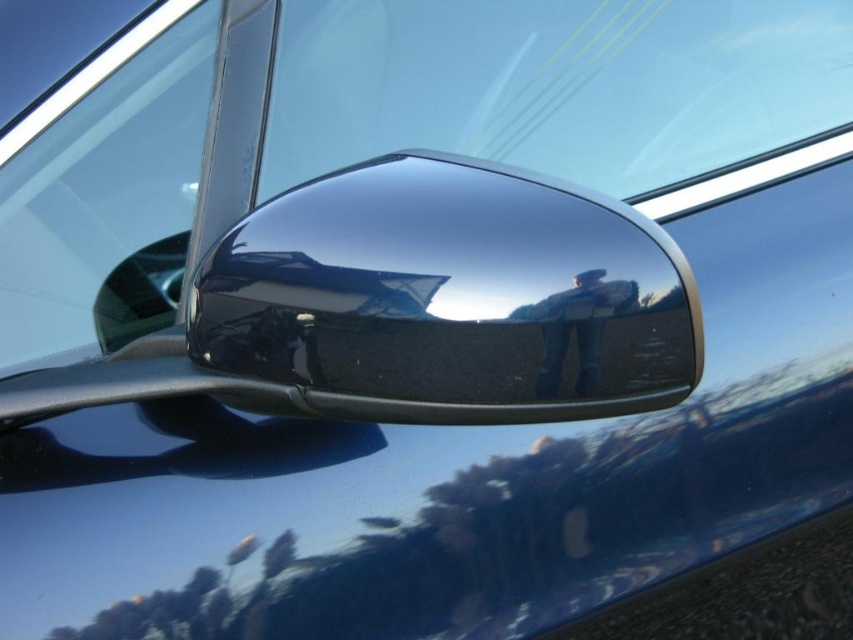
Question: Is transparent glass car window at upper left positioned at the back of glossy chrome side mirror at lower left?

Choices:
 (A) no
 (B) yes

Answer: (B)

Question: Estimate the real-world distances between objects in this image. Which object is farther from the glossy chrome side mirror at lower left?

Choices:
 (A) transparent glass car window at upper left
 (B) glossy chrome mirror at center

Answer: (A)

Question: Is the position of transparent glass car window at upper left less distant than that of glossy chrome side mirror at lower left?

Choices:
 (A) yes
 (B) no

Answer: (B)

Question: Is transparent glass car window at upper left to the right of glossy chrome side mirror at lower left from the viewer's perspective?

Choices:
 (A) yes
 (B) no

Answer: (B)

Question: Which object is positioned farthest from the transparent glass car window at upper left?

Choices:
 (A) glossy chrome mirror at center
 (B) glossy chrome side mirror at lower left

Answer: (A)

Question: Considering the real-world distances, which object is farthest from the glossy chrome mirror at center?

Choices:
 (A) glossy chrome side mirror at lower left
 (B) transparent glass car window at upper left

Answer: (B)